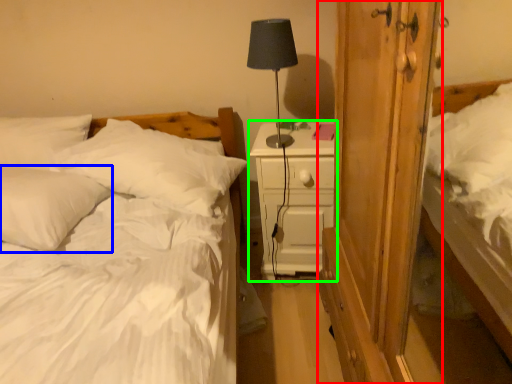
Question: Which object is the closest to the armoire (highlighted by a red box)? Choose among these: pillow (highlighted by a blue box) or nightstand (highlighted by a green box).

Choices:
 (A) pillow
 (B) nightstand

Answer: (B)